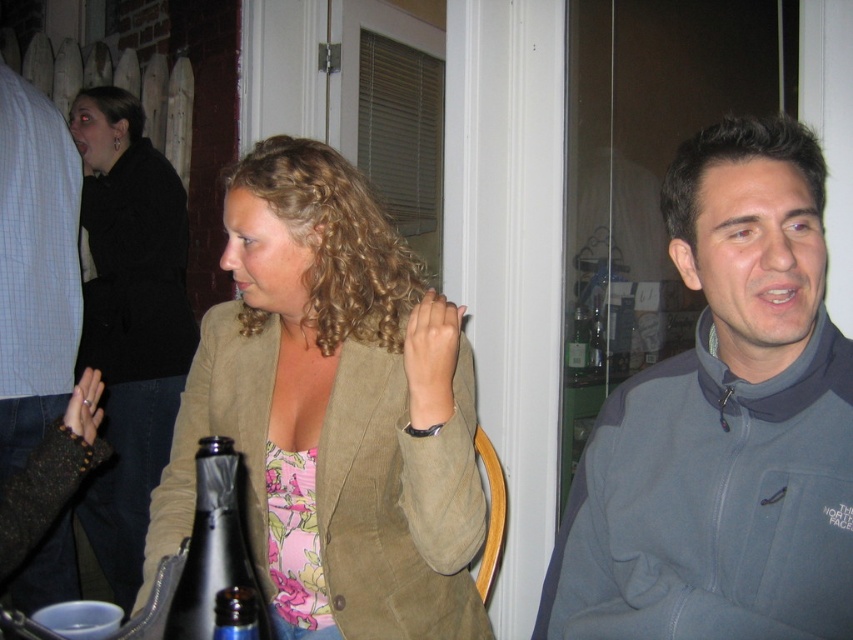
Between point (252, 524) and point (143, 442), which one is positioned in front?

Point (252, 524)

Is point (383, 301) farther from viewer compared to point (160, 401)?

No.

I want to click on suede jacket at center, so click(x=334, y=412).

Who is more forward, (x=720, y=541) or (x=236, y=618)?

Point (x=236, y=618) is in front.

Is point (695, 205) positioned after point (247, 616)?

Yes, it is behind point (247, 616).

I want to click on gray fleece jacket at right, so click(x=723, y=424).

Which is behind, point (212, 532) or point (599, 316)?

The point (599, 316) is more distant.

You are a GUI agent. You are given a task and a screenshot of the screen. Output one action in this format:
    pyautogui.click(x=<x>, y=<y>)
    Task: Click on the silver metallic wine bottle at lower left
    
    Given the screenshot: What is the action you would take?
    216,556